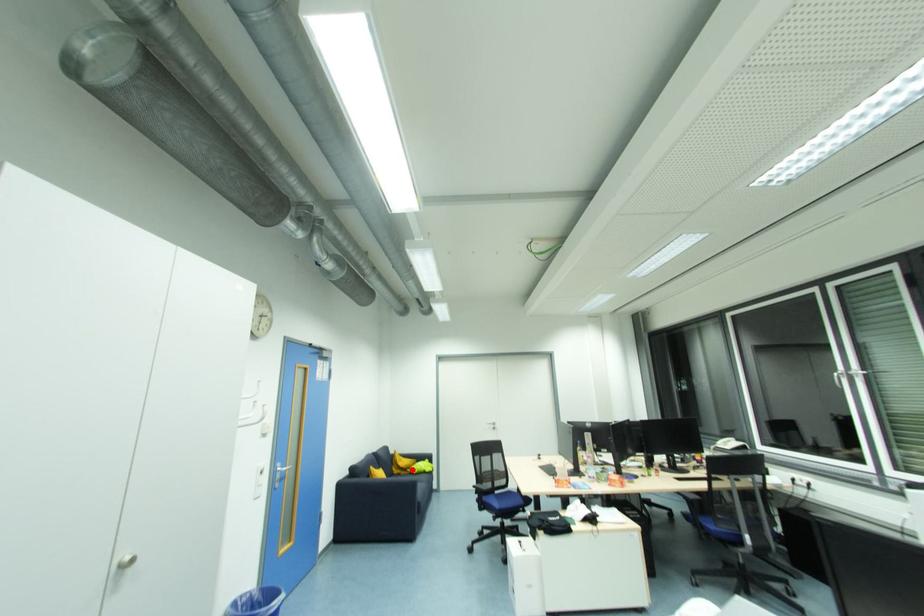
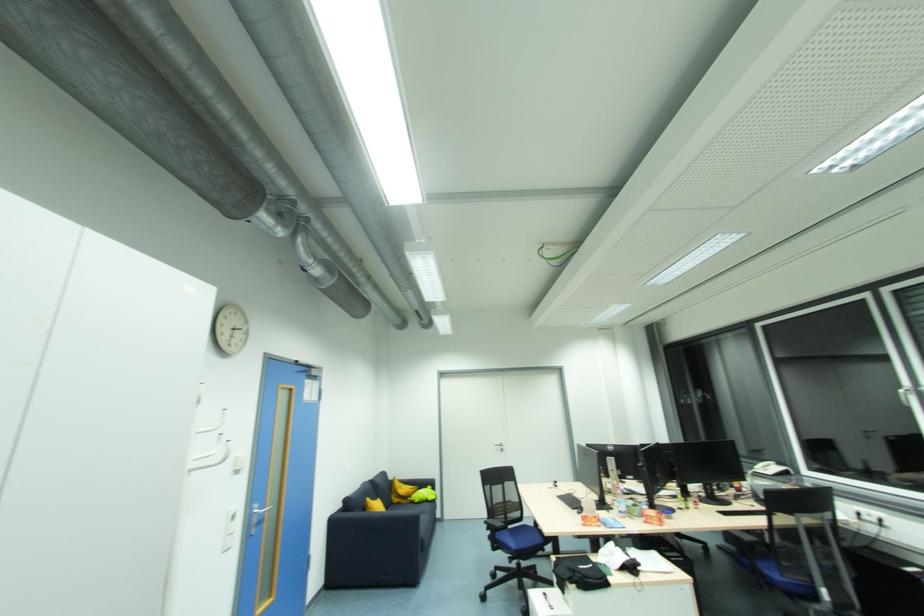
Locate, in the second image, the point that corresponds to the highlighted location in the first image.

(412, 499)